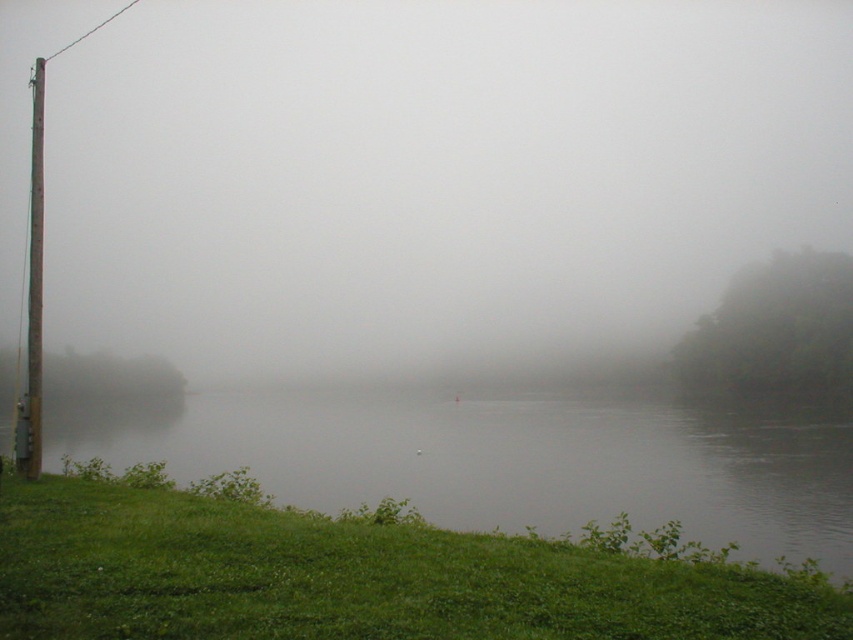
Which is below, green grassy bank at lower left or brown rough wooden pole at left?

green grassy bank at lower left is below.

Can you confirm if green grassy bank at lower left is wider than brown rough wooden pole at left?

No, green grassy bank at lower left is not wider than brown rough wooden pole at left.

This screenshot has width=853, height=640. I want to click on green grassy bank at lower left, so click(x=509, y=456).

What are the coordinates of `green grassy bank at lower left` in the screenshot? It's located at (509, 456).

Can you confirm if green grassy hillside at lower left is positioned to the right of brown rough wooden pole at left?

Correct, you'll find green grassy hillside at lower left to the right of brown rough wooden pole at left.

Describe the element at coordinates (354, 579) in the screenshot. I see `green grassy hillside at lower left` at that location.

Image resolution: width=853 pixels, height=640 pixels. What do you see at coordinates (354, 579) in the screenshot? I see `green grassy hillside at lower left` at bounding box center [354, 579].

Find the location of a particular element. green grassy hillside at lower left is located at coordinates (354, 579).

Does green grassy bank at lower left have a greater height compared to green grassy hillside at lower left?

Yes.

Can you confirm if green grassy bank at lower left is wider than green grassy hillside at lower left?

Correct, the width of green grassy bank at lower left exceeds that of green grassy hillside at lower left.

Is point (746, 525) closer to camera compared to point (55, 596)?

No.

You are a GUI agent. You are given a task and a screenshot of the screen. Output one action in this format:
    pyautogui.click(x=<x>, y=<y>)
    Task: Click on the green grassy bank at lower left
    The width and height of the screenshot is (853, 640).
    Given the screenshot: What is the action you would take?
    pyautogui.click(x=509, y=456)